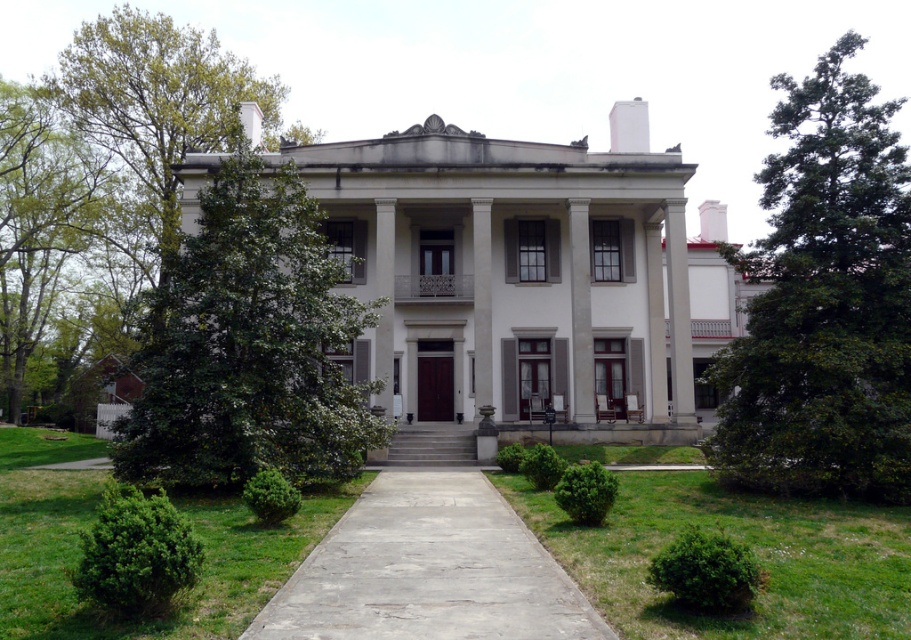
Question: Is green grass at center bigger than green grass at lower left?

Choices:
 (A) yes
 (B) no

Answer: (B)

Question: Is green leafy tree at right bigger than green leafy tree at upper left?

Choices:
 (A) no
 (B) yes

Answer: (A)

Question: Which is farther from the green leafy tree at right?

Choices:
 (A) gray concrete pathway at center
 (B) green grass at lower left
 (C) green grass at center
 (D) green leafy tree at center

Answer: (B)

Question: Which object is positioned closest to the green grass at lower left?

Choices:
 (A) green leafy tree at upper left
 (B) white smooth mansion at center
 (C) green grass at center
 (D) green leafy tree at center

Answer: (C)

Question: Which of the following is the farthest from the observer?

Choices:
 (A) green leafy tree at upper left
 (B) green grass at center
 (C) green leafy tree at right

Answer: (A)

Question: Is green grass at center wider than gray concrete pathway at center?

Choices:
 (A) yes
 (B) no

Answer: (A)